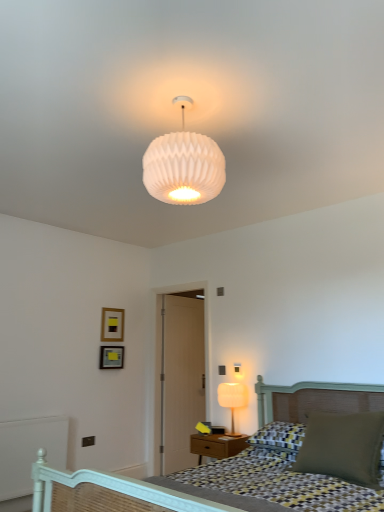
Question: From a real-world perspective, relative to white painted wood balustrade at lower left, is matte white lamp at right, placed as the 2th lamp when sorted from front to back, vertically above or below?

Choices:
 (A) above
 (B) below

Answer: (A)

Question: Considering the positions of point (231, 416) and point (16, 480), is point (231, 416) closer or farther from the camera than point (16, 480)?

Choices:
 (A) farther
 (B) closer

Answer: (A)

Question: Which is farther from the checkered fabric bed at lower right?

Choices:
 (A) white ribbed glass lampshade at upper center, acting as the first lamp starting from the top
 (B) wooden door at center
 (C) matte green pillow at lower right
 (D) white painted wood balustrade at lower left
 (E) matte gold picture frame at upper left, which is the 2th picture frame from bottom to top

Answer: (B)

Question: Estimate the real-world distances between objects in this image. Which object is farther from the white ribbed glass lampshade at upper center, the second lamp viewed from the back?

Choices:
 (A) matte white lamp at right, the 1th lamp from the bottom
 (B) white painted wood balustrade at lower left
 (C) checkered fabric bed at lower right
 (D) matte gold picture frame at upper left, which is the 2th picture frame from bottom to top
 (E) wooden door at center

Answer: (E)